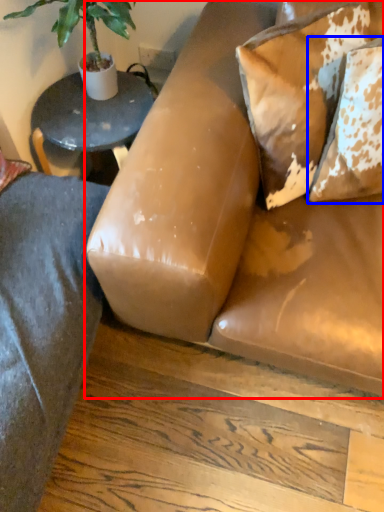
Question: Which of the following is the closest to the observer, studio couch (highlighted by a red box) or pillow (highlighted by a blue box)?

Choices:
 (A) studio couch
 (B) pillow

Answer: (A)